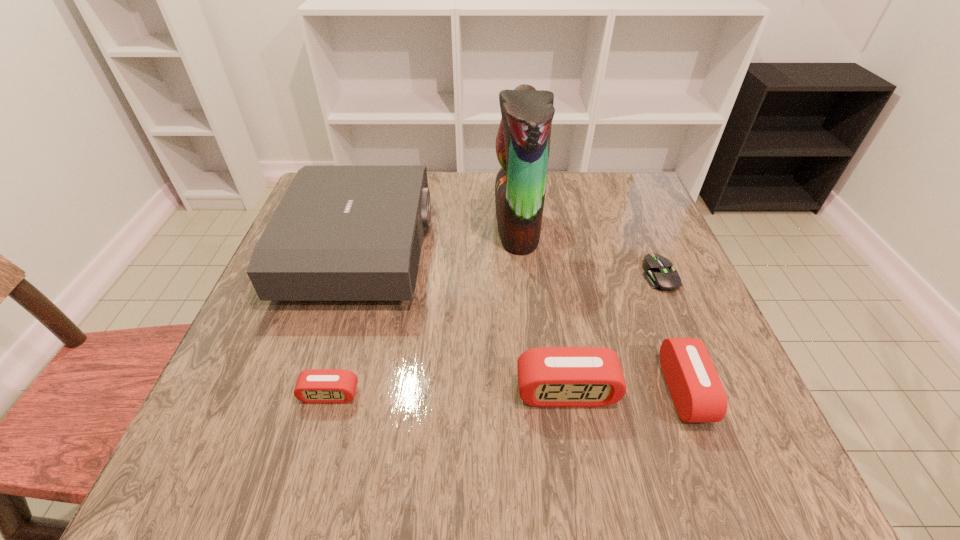
I want to click on free point located at the face of the parrot, so click(x=359, y=225).

Find the location of a particular element. vacant space located at the face of the parrot is located at coordinates (375, 225).

I want to click on free space located 0.340m on the front-facing side of the projector, so click(x=572, y=249).

The image size is (960, 540). Identify the location of vacant space located 0.280m on the left of the shortest object. (516, 275).

Find the location of a particular element. The image size is (960, 540). parrot situated at the far edge is located at coordinates (523, 140).

This screenshot has width=960, height=540. I want to click on projector located at the far edge, so click(340, 233).

The width and height of the screenshot is (960, 540). I want to click on alarm clock at the left edge, so click(315, 385).

What are the coordinates of `projector located at the left edge` in the screenshot? It's located at (340, 233).

Locate an element on the screen. alarm clock present at the right edge is located at coordinates (697, 392).

The width and height of the screenshot is (960, 540). I want to click on computer mouse positioned at the right edge, so click(659, 274).